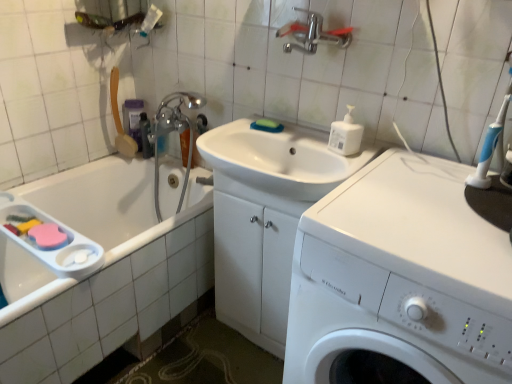
Locate an element on the screen. The width and height of the screenshot is (512, 384). vacant region to the left of blue plastic toothbrush at upper right is located at coordinates (419, 183).